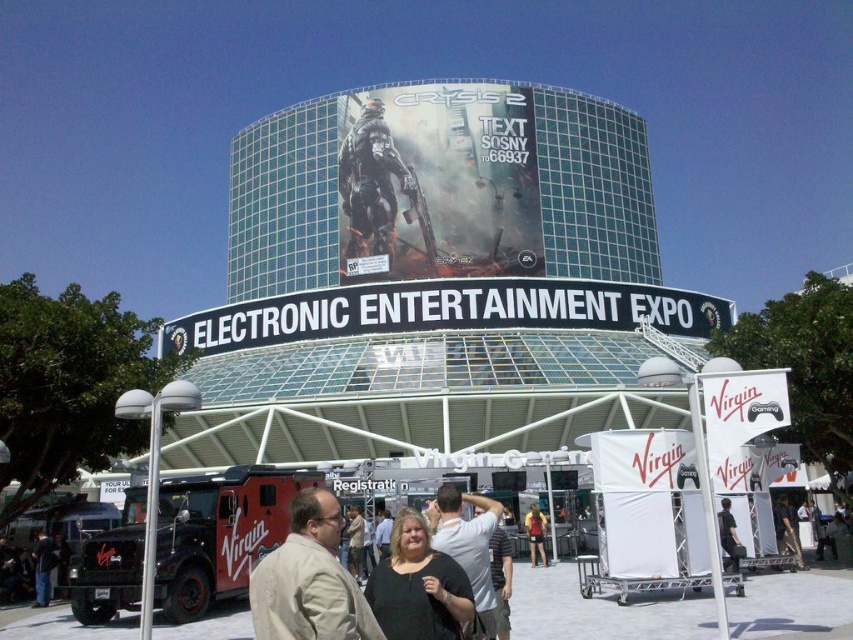
Is black matte shirt at center closer to the viewer compared to yellow fabric shirt at center?

Yes, it is in front of yellow fabric shirt at center.

Describe the element at coordinates (418, 586) in the screenshot. I see `black matte shirt at center` at that location.

Identify the location of black matte shirt at center. The width and height of the screenshot is (853, 640). (418, 586).

Which is more to the right, light brown leather jacket at center or yellow fabric shirt at center?

Positioned to the right is yellow fabric shirt at center.

The height and width of the screenshot is (640, 853). Describe the element at coordinates (355, 541) in the screenshot. I see `light brown leather jacket at center` at that location.

Does point (358, 515) lie behind point (527, 516)?

That is False.

Image resolution: width=853 pixels, height=640 pixels. What are the coordinates of `light brown leather jacket at center` in the screenshot? It's located at (355, 541).

Can you confirm if black matte shirt at center is thinner than light gray shirt at center?

Yes, black matte shirt at center is thinner than light gray shirt at center.

Does point (375, 612) come behind point (440, 492)?

No, it is in front of (440, 492).

Image resolution: width=853 pixels, height=640 pixels. Identify the location of black matte shirt at center. (418, 586).